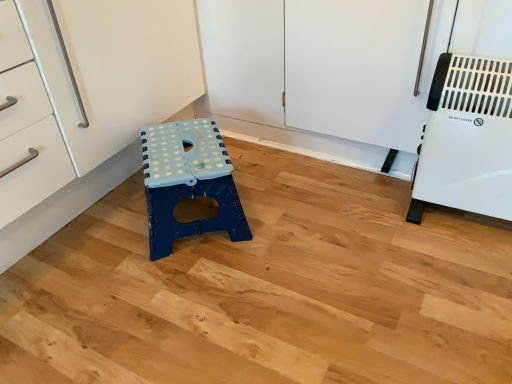
I want to click on white plastic heater at right, so click(x=467, y=139).

What do you see at coordinates (467, 139) in the screenshot?
I see `white plastic heater at right` at bounding box center [467, 139].

The image size is (512, 384). Identify the location of blue plastic stool at center. (188, 182).

What do you see at coordinates (188, 182) in the screenshot? The height and width of the screenshot is (384, 512). I see `blue plastic stool at center` at bounding box center [188, 182].

Locate an element on the screen. white plastic heater at right is located at coordinates (467, 139).

Is white plastic heater at right at the right side of blue plastic stool at center?

Yes.

Considering their positions, is white plastic heater at right located in front of or behind blue plastic stool at center?

Clearly, white plastic heater at right is in front of blue plastic stool at center.

Is point (499, 203) closer to viewer compared to point (152, 256)?

Yes, point (499, 203) is in front of point (152, 256).

From the image's perspective, which is above, white plastic heater at right or blue plastic stool at center?

white plastic heater at right.

From a real-world perspective, is white plastic heater at right below blue plastic stool at center?

Actually, white plastic heater at right is physically above blue plastic stool at center in the real world.

Looking at their sizes, would you say white plastic heater at right is wider or thinner than blue plastic stool at center?

white plastic heater at right is thinner than blue plastic stool at center.

Considering the relative sizes of white plastic heater at right and blue plastic stool at center in the image provided, is white plastic heater at right shorter than blue plastic stool at center?

Incorrect, the height of white plastic heater at right does not fall short of that of blue plastic stool at center.

Considering the relative sizes of white plastic heater at right and blue plastic stool at center in the image provided, is white plastic heater at right bigger than blue plastic stool at center?

No.

Is blue plastic stool at center surrounded by white plastic heater at right?

No, blue plastic stool at center is not inside white plastic heater at right.

Can you see white plastic heater at right touching blue plastic stool at center?

No, white plastic heater at right is not touching blue plastic stool at center.

Is blue plastic stool at center at the back of white plastic heater at right?

white plastic heater at right does not have its back to blue plastic stool at center.

What's the angular difference between white plastic heater at right and blue plastic stool at center's facing directions?

41.4 degrees.

The width and height of the screenshot is (512, 384). What are the coordinates of `appliance that appears in front of the blue plastic stool at center` in the screenshot? It's located at (467, 139).

Based on the photo, does blue plastic stool at center appear on the left side of white plastic heater at right?

Correct, you'll find blue plastic stool at center to the left of white plastic heater at right.

Considering the relative positions of blue plastic stool at center and white plastic heater at right in the image provided, is blue plastic stool at center behind white plastic heater at right?

Yes, blue plastic stool at center is further from the viewer.

Is point (220, 189) positioned behind point (504, 167)?

That is True.

From the image's perspective, is blue plastic stool at center above white plastic heater at right?

Actually, blue plastic stool at center appears below white plastic heater at right in the image.

Looking at this image, from a real-world perspective, who is located higher, blue plastic stool at center or white plastic heater at right?

white plastic heater at right.

Does blue plastic stool at center have a greater width compared to white plastic heater at right?

Yes.

Can you confirm if blue plastic stool at center is taller than white plastic heater at right?

No.

Based on their sizes in the image, would you say blue plastic stool at center is bigger or smaller than white plastic heater at right?

blue plastic stool at center is bigger than white plastic heater at right.

Is white plastic heater at right surrounded by blue plastic stool at center?

No, white plastic heater at right is located outside of blue plastic stool at center.

Is blue plastic stool at center far away from white plastic heater at right?

No, blue plastic stool at center is not far from white plastic heater at right.

Is white plastic heater at right at the back of blue plastic stool at center?

That's not correct — blue plastic stool at center is not looking away from white plastic heater at right.

How different are the orientations of blue plastic stool at center and white plastic heater at right in degrees?

blue plastic stool at center and white plastic heater at right are facing 41.4 degrees away from each other.

In the image, there is a white plastic heater at right. Where is `furniture below it (from a real-world perspective)`? furniture below it (from a real-world perspective) is located at coordinates (x=188, y=182).

Locate an element on the screen. The width and height of the screenshot is (512, 384). appliance in front of the blue plastic stool at center is located at coordinates (467, 139).

What are the coordinates of `appliance above the blue plastic stool at center (from a real-world perspective)` in the screenshot? It's located at coord(467,139).